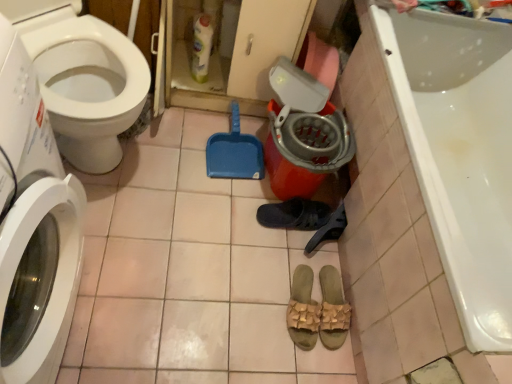
Question: Is pink tile at lower center inside or outside of white glossy bathtub at lower right?

Choices:
 (A) outside
 (B) inside

Answer: (A)

Question: In the image, is pink tile at lower center positioned in front of or behind white glossy bathtub at lower right?

Choices:
 (A) front
 (B) behind

Answer: (B)

Question: Which object is the closest to the tan woven sandals at center, which is the second footwear from top to bottom?

Choices:
 (A) translucent plastic bottle at upper center
 (B) white glossy toilet at left
 (C) dark gray fabric slipper at center, the 1th footwear in the top-to-bottom sequence
 (D) black rubber shoe at center
 (E) tan woven sandals at center, the first footwear when ordered from bottom to top

Answer: (E)

Question: Considering the real-world distances, which object is closest to the white glossy washing machine at left?

Choices:
 (A) translucent plastic bottle at upper center
 (B) dark gray fabric slipper at center, which is counted as the 3th footwear, starting from the bottom
 (C) white glossy bathtub at lower right
 (D) black rubber shoe at center
 (E) tan woven sandals at center, marked as the 3th footwear in a top-to-bottom arrangement

Answer: (B)